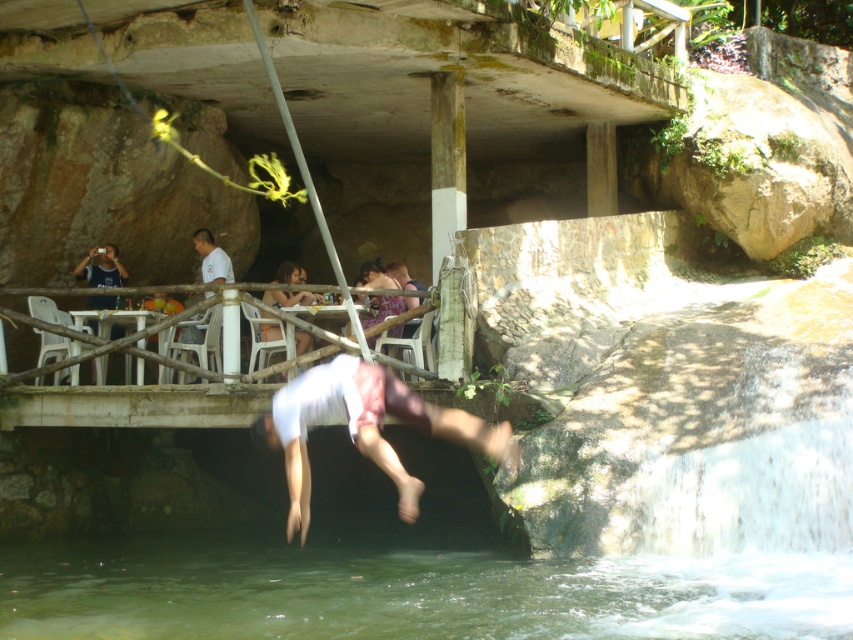
Question: Which object is farther from the camera taking this photo?

Choices:
 (A) matte purple dress at center
 (B) white cotton shorts at center

Answer: (A)

Question: Which of these objects is positioned farthest from the clear water at lower center?

Choices:
 (A) white cotton shorts at center
 (B) matte purple dress at center
 (C) matte pink shorts at center

Answer: (C)

Question: Does matte pink shorts at center appear over matte purple dress at center?

Choices:
 (A) yes
 (B) no

Answer: (B)

Question: Is clear water at lower center thinner than matte pink shorts at center?

Choices:
 (A) yes
 (B) no

Answer: (B)

Question: Estimate the real-world distances between objects in this image. Which object is closer to the white cotton shorts at center?

Choices:
 (A) clear water at lower center
 (B) matte purple dress at center
 (C) matte pink shorts at center

Answer: (B)

Question: Can you confirm if white cotton shorts at center is wider than matte pink shorts at center?

Choices:
 (A) no
 (B) yes

Answer: (B)